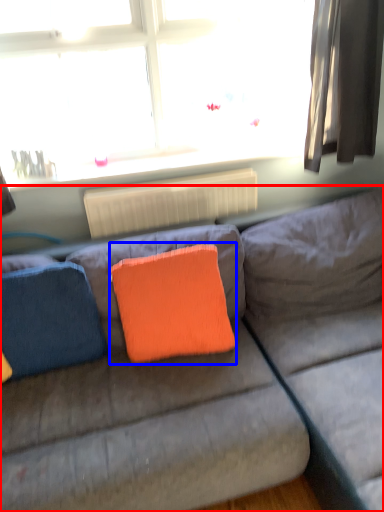
Question: Among these objects, which one is farthest to the camera, studio couch (highlighted by a red box) or throw pillow (highlighted by a blue box)?

Choices:
 (A) studio couch
 (B) throw pillow

Answer: (B)